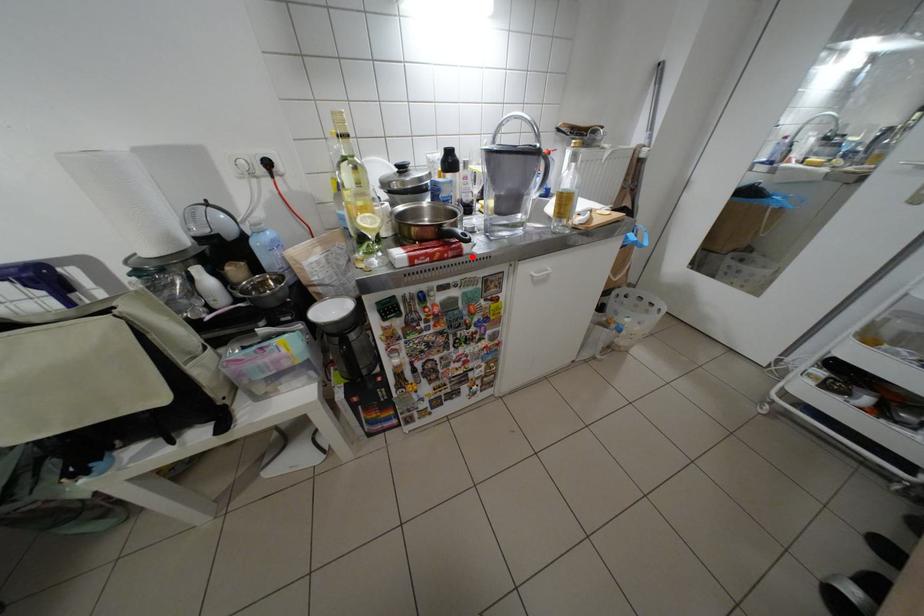
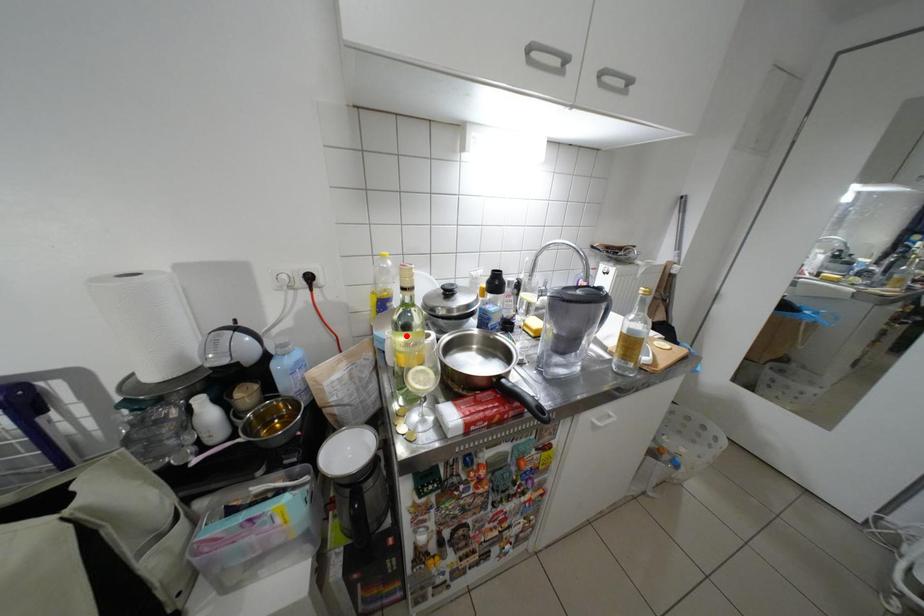
I am providing you with two images of the same scene from different viewpoints. A red point is marked on the first image and another point is marked on the second image. Does the point marked in image1 correspond to the same location as the one in image2?

No